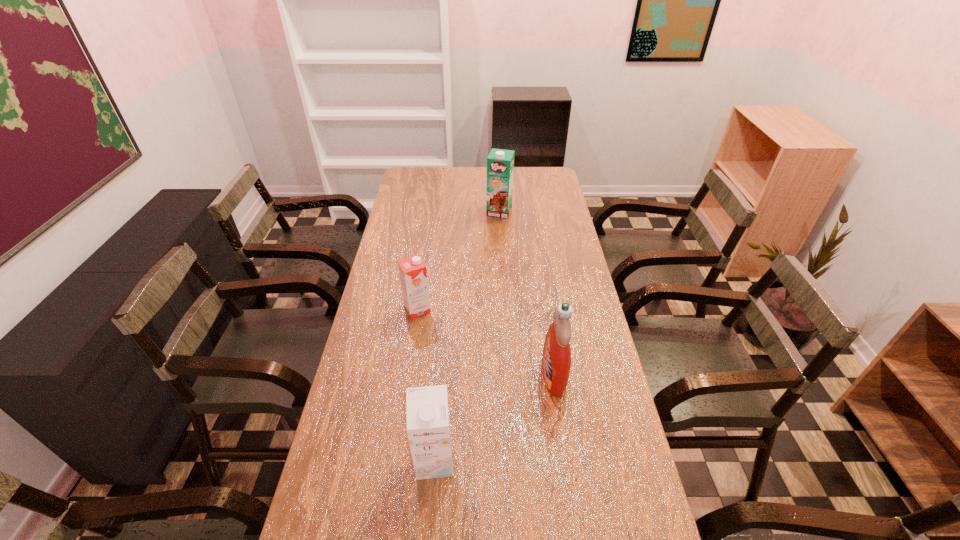
Where is `the farthest carton`? This screenshot has width=960, height=540. the farthest carton is located at coordinates (500, 163).

Locate an element on the screen. the rightmost carton is located at coordinates (500, 163).

The height and width of the screenshot is (540, 960). Identify the location of the rightmost object. (556, 360).

Identify the location of the second nearest object. This screenshot has width=960, height=540. (556, 360).

Identify the location of the third object from right to left. [x=427, y=414].

Where is `the nearest object`? Image resolution: width=960 pixels, height=540 pixels. the nearest object is located at coordinates (427, 414).

Where is `the shortest carton`? the shortest carton is located at coordinates (413, 275).

The image size is (960, 540). I want to click on the second nearest carton, so click(x=413, y=275).

Find the location of `vacant area located 0.350m on the back of the third object from left to right`. vacant area located 0.350m on the back of the third object from left to right is located at coordinates (496, 167).

Image resolution: width=960 pixels, height=540 pixels. I want to click on blank space located 0.360m on the front surface of the detergent, so click(416, 375).